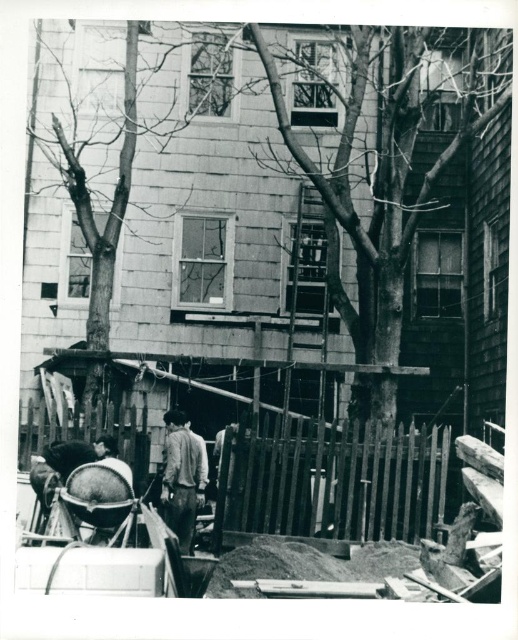
Who is higher up, wooden picket fence at lower center or light brown leather jacket at center?

Positioned higher is wooden picket fence at lower center.

This screenshot has height=640, width=518. What are the coordinates of `wooden picket fence at lower center` in the screenshot? It's located at (339, 477).

Does bare wood tree at center lie in front of light brown leather jacket at center?

No, bare wood tree at center is behind light brown leather jacket at center.

Does bare wood tree at center appear on the left side of light brown leather jacket at center?

Yes, bare wood tree at center is to the left of light brown leather jacket at center.

Image resolution: width=518 pixels, height=640 pixels. I want to click on bare wood tree at center, so (91, 198).

Is wooden picket fence at lower center further to camera compared to bare wood tree at center?

No, it is in front of bare wood tree at center.

Is wooden picket fence at lower center shorter than bare wood tree at center?

Correct, wooden picket fence at lower center is not as tall as bare wood tree at center.

Consider the image. Who is more forward, (x=134, y=458) or (x=133, y=60)?

Point (x=134, y=458)

You are a GUI agent. You are given a task and a screenshot of the screen. Output one action in this format:
    pyautogui.click(x=<x>, y=<y>)
    Task: Click on the wooden picket fence at lower center
    The image size is (518, 640).
    Given the screenshot: What is the action you would take?
    pyautogui.click(x=339, y=477)